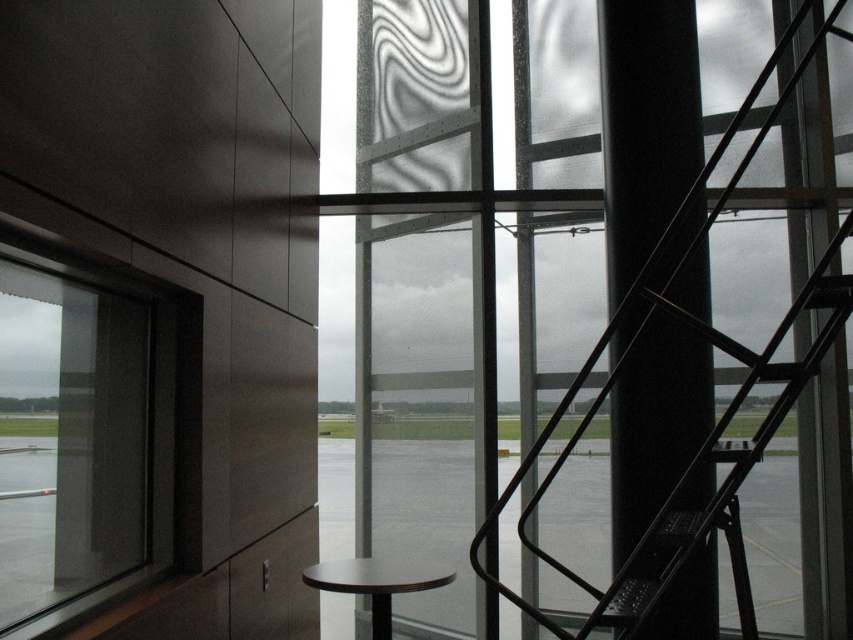
Which is above, smooth asphalt tarmac at center or matte black stool at lower center?

matte black stool at lower center is higher up.

Identify the location of smooth asphalt tarmac at center. (335, 497).

You are a GUI agent. You are given a task and a screenshot of the screen. Output one action in this format:
    pyautogui.click(x=<x>, y=<y>)
    Task: Click on the smooth asphalt tarmac at center
    
    Given the screenshot: What is the action you would take?
    pyautogui.click(x=335, y=497)

Can you confirm if metallic black ladder at right is shorter than transparent glass window at left?

Incorrect, metallic black ladder at right's height does not fall short of transparent glass window at left's.

Can you confirm if metallic black ladder at right is positioned to the right of transparent glass window at left?

Indeed, metallic black ladder at right is positioned on the right side of transparent glass window at left.

Is point (763, 292) in front of point (181, 317)?

No, it is behind (181, 317).

You are a GUI agent. You are given a task and a screenshot of the screen. Output one action in this format:
    pyautogui.click(x=<x>, y=<y>)
    Task: Click on the metallic black ladder at right
    The height and width of the screenshot is (640, 853).
    Given the screenshot: What is the action you would take?
    pyautogui.click(x=614, y=250)

Between metallic black ladder at right and matte black stool at lower center, which one has more height?

metallic black ladder at right is taller.

Where is `metallic black ladder at right`? metallic black ladder at right is located at coordinates click(x=614, y=250).